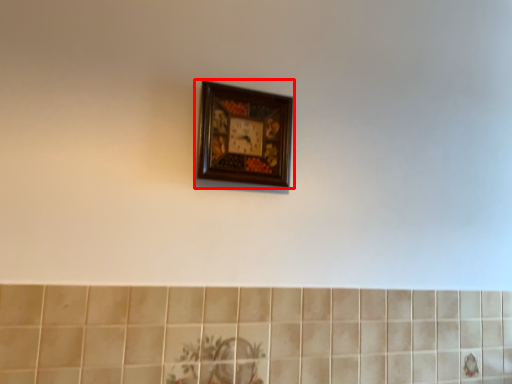
Question: From the image's perspective, where is picture frame (annotated by the red box) located in relation to ceramic tile in the image?

Choices:
 (A) below
 (B) above

Answer: (B)